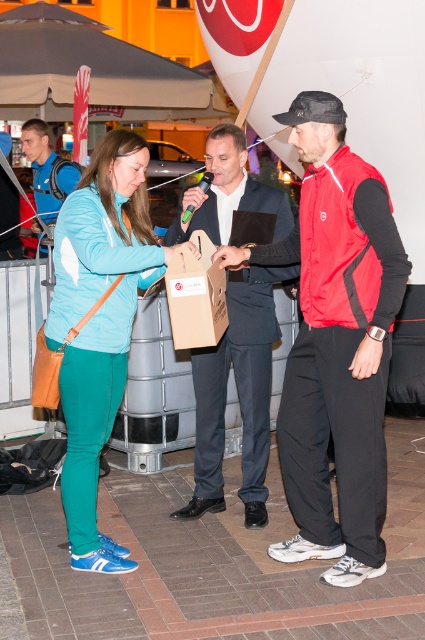
Question: Is teal fabric jacket at left below brown cardboard box at center?

Choices:
 (A) no
 (B) yes

Answer: (B)

Question: Which point is closer to the camera?

Choices:
 (A) (36, 198)
 (B) (201, 468)
 (C) (45, 108)

Answer: (B)

Question: Which of the following is the farthest from the observer?

Choices:
 (A) (365, 170)
 (B) (82, 168)
 (C) (81, 332)

Answer: (B)

Question: Does red synthetic vest at center appear on the left side of brown cardboard box at center?

Choices:
 (A) no
 (B) yes

Answer: (A)

Question: Based on their relative distances, which object is nearer to the brown cardboard box at center?

Choices:
 (A) red synthetic vest at center
 (B) gray fabric canopy at upper center
 (C) blue fabric backpack at left
 (D) matte black suit at center

Answer: (D)

Question: Does gray fabric canopy at upper center come behind brown cardboard box at center?

Choices:
 (A) yes
 (B) no

Answer: (A)